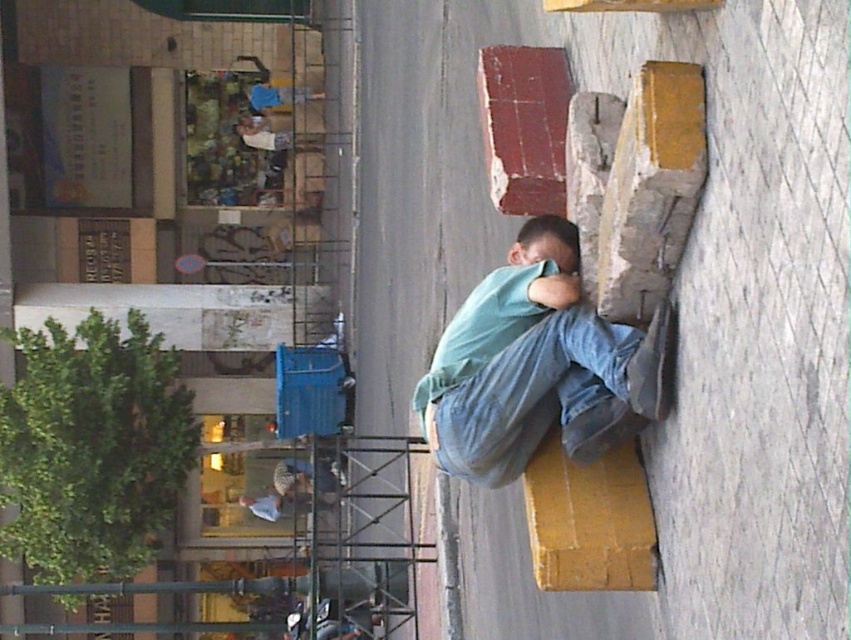
Between denim at right and light blue denim pants at lower center, which one appears on the left side from the viewer's perspective?

Positioned to the left is light blue denim pants at lower center.

Find the location of a particular element. The width and height of the screenshot is (851, 640). denim at right is located at coordinates (540, 397).

Identify the location of denim at right. Image resolution: width=851 pixels, height=640 pixels. (540, 397).